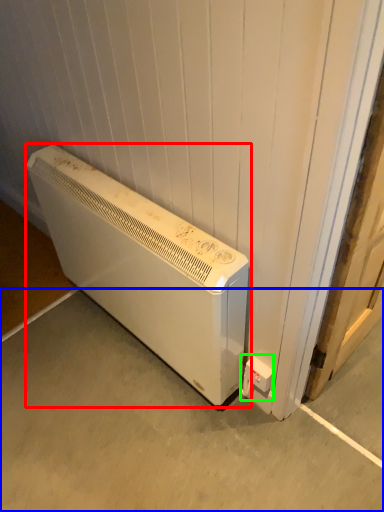
Question: Which object is positioned closest to home appliance (highlighted by a red box)? Select from concrete (highlighted by a blue box) and electric outlet (highlighted by a green box).

Choices:
 (A) concrete
 (B) electric outlet

Answer: (A)